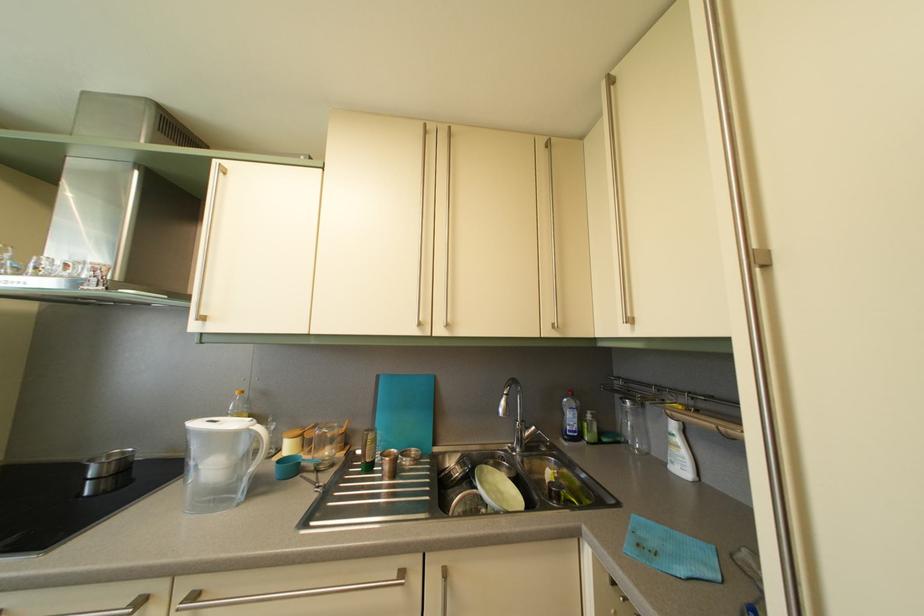
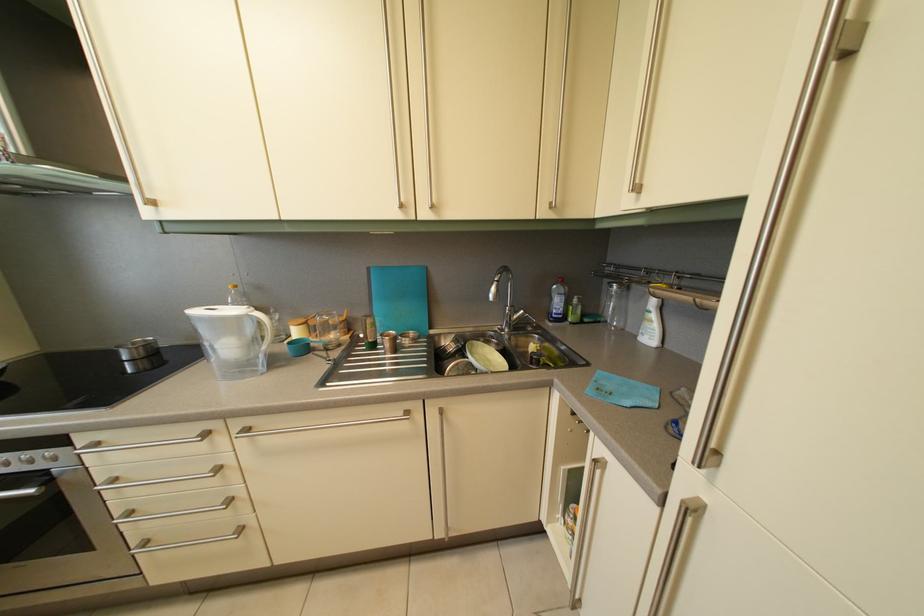
In a continuous first-person perspective shot, in which direction is the camera moving?

The movement direction of the cameraman is right, forward.